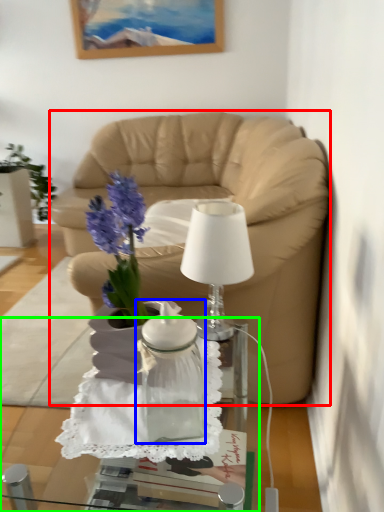
Question: Considering the real-world distances, which object is farthest from studio couch (highlighted by a red box)? vase (highlighted by a blue box) or desk (highlighted by a green box)?

Choices:
 (A) vase
 (B) desk

Answer: (B)